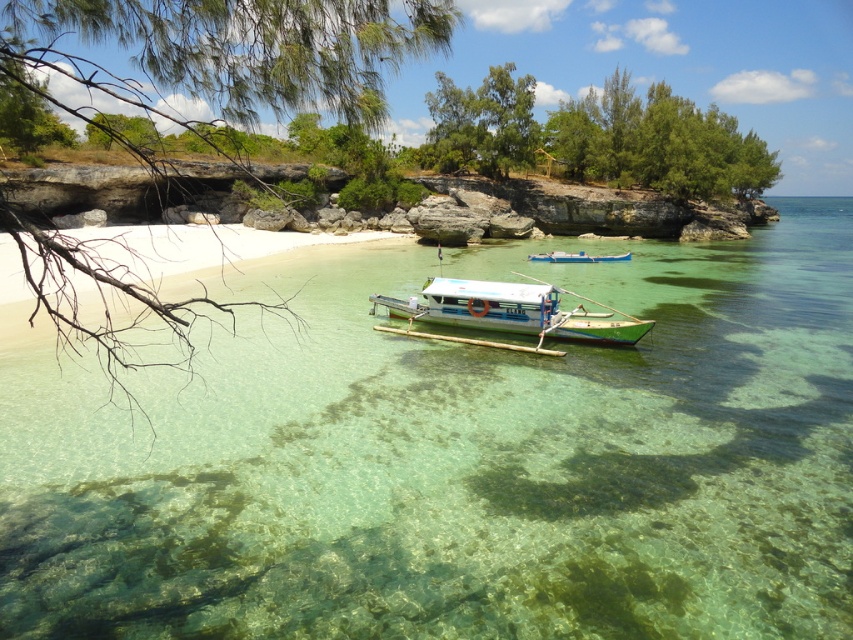
You are standing on the beach and want to take a photo of both the clear glassy water at center and the white matte boat at center. Which object should you position to the left side of your camera frame to include both in the shot?

You should position the white matte boat at center to the left side of your camera frame because the clear glassy water at center is to the right of it.

You are a photographer planning to capture the entire scene of the clear glassy water at center and the white matte boat at center in one shot. Given that your camera has a fixed focal length, which object should you prioritize framing first to ensure both are included in the photo?

You should prioritize framing the white matte boat at center first because the clear glassy water at center is wider than the boat, so ensuring the boat fits will automatically include the water since it is wider.